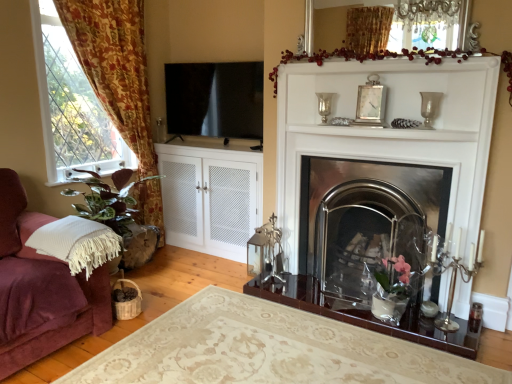
Question: Is point (448, 130) positioned closer to the camera than point (426, 99)?

Choices:
 (A) farther
 (B) closer

Answer: (B)

Question: Is white glossy mantle at center taller or shorter than clear glass vase at upper right, which is the second candle holder in left-to-right order?

Choices:
 (A) short
 (B) tall

Answer: (A)

Question: Based on their relative distances, which object is nearer to the polished stainless steel fireplace at center?

Choices:
 (A) white glossy mantle at center
 (B) white mesh cabinet at center
 (C) clear glass vase at upper right, placed as the 2th candle holder when sorted from right to left
 (D) floral fabric curtain at left
 (E) clear glass vase at upper center, which is the first candle holder in left-to-right order

Answer: (A)

Question: Based on their relative distances, which object is nearer to the white mesh cabinet at center?

Choices:
 (A) clear glass vase at upper right, which is the second candle holder in left-to-right order
 (B) silver metallic candle holder at right, the third candle holder viewed from the left
 (C) clear glass vase at upper center, which is the first candle holder in left-to-right order
 (D) clear glass vase at upper center, the 2th plant from the left
 (E) white glossy mantle at center

Answer: (E)